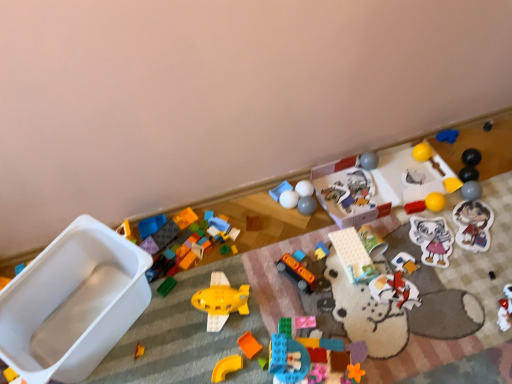
Image resolution: width=512 pixels, height=384 pixels. I want to click on vacant space to the right of rubber duck at center, which ranks as the eleventh toy in right-to-left order, so click(x=368, y=253).